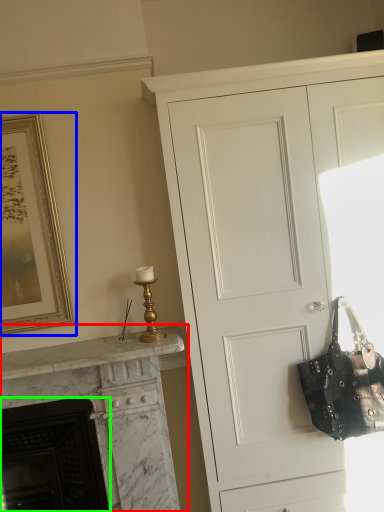
Question: Estimate the real-world distances between objects in this image. Which object is farther from fireplace (highlighted by a red box), picture frame (highlighted by a blue box) or fireplace (highlighted by a green box)?

Choices:
 (A) picture frame
 (B) fireplace

Answer: (A)